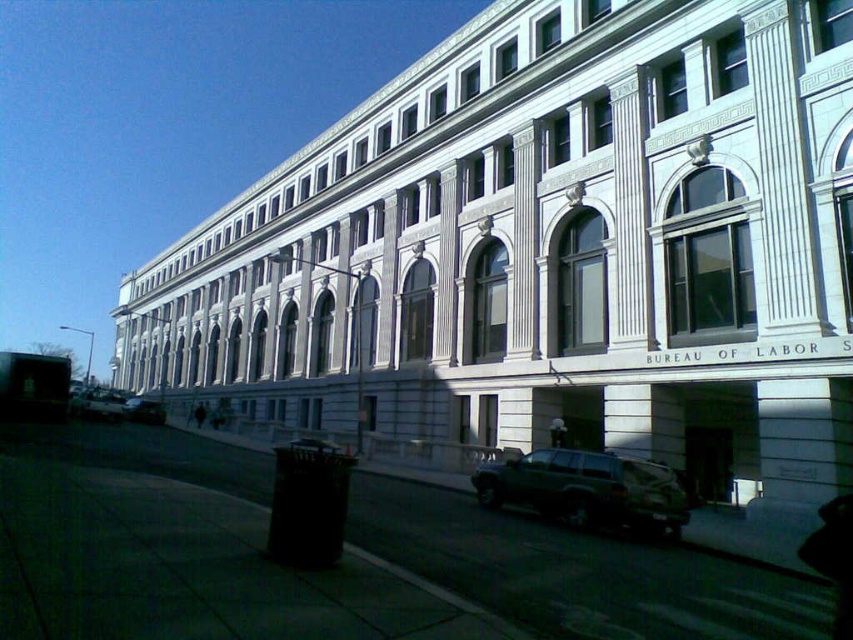
Who is lower down, dark green matte suv at lower center or silver metallic suv at lower left?

silver metallic suv at lower left is below.

Who is positioned more to the left, dark green matte suv at lower center or silver metallic suv at lower left?

From the viewer's perspective, silver metallic suv at lower left appears more on the left side.

From the picture: Measure the distance between point (483, 474) and camera.

They are 16.58 meters apart.

This screenshot has width=853, height=640. I want to click on dark green matte suv at lower center, so click(587, 490).

Which is above, dark green matte suv at lower center or metallic silver suv at lower left?

Positioned higher is dark green matte suv at lower center.

Is dark green matte suv at lower center positioned in front of metallic silver suv at lower left?

Yes, dark green matte suv at lower center is in front of metallic silver suv at lower left.

Identify the location of dark green matte suv at lower center. The image size is (853, 640). (587, 490).

Locate an element on the screen. The image size is (853, 640). dark green matte suv at lower center is located at coordinates (587, 490).

Who is positioned more to the right, metallic silver suv at lower left or silver metallic suv at lower left?

silver metallic suv at lower left is more to the right.

Is metallic silver suv at lower left smaller than silver metallic suv at lower left?

Incorrect, metallic silver suv at lower left is not smaller in size than silver metallic suv at lower left.

At what (x,y) coordinates should I click in order to perform the action: click on metallic silver suv at lower left. Please return your answer as a coordinate pair (x, y). The height and width of the screenshot is (640, 853). Looking at the image, I should click on (97, 404).